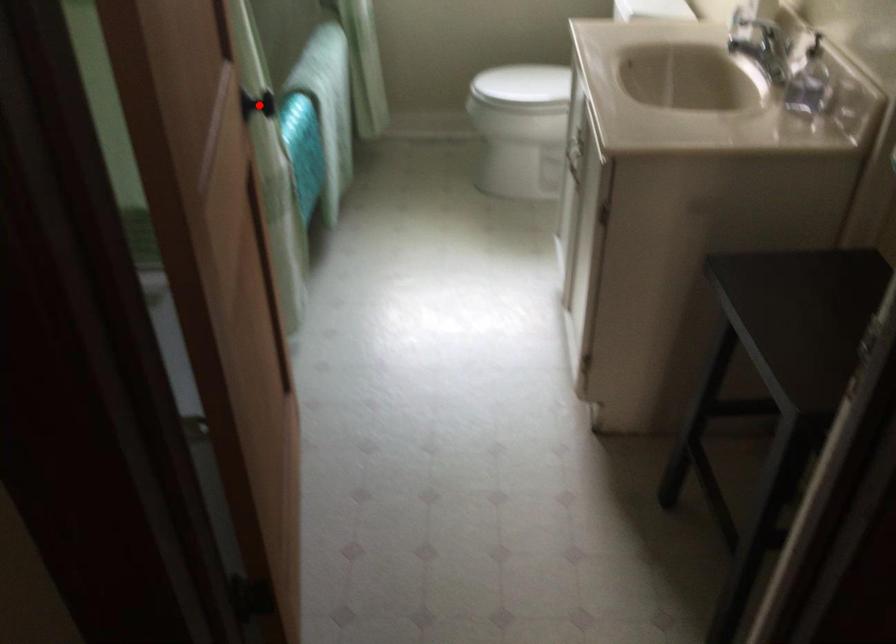
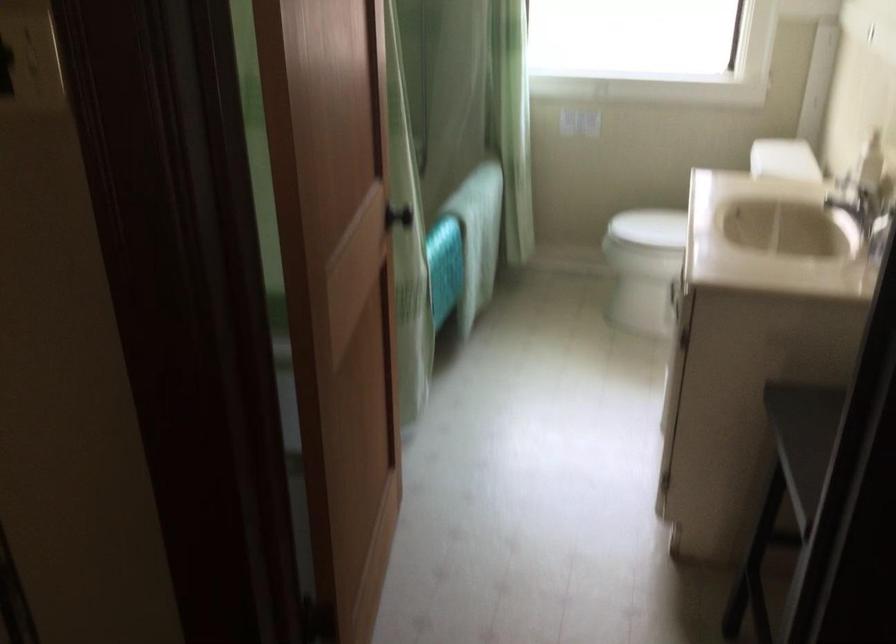
In the second image, find the point that corresponds to the highlighted location in the first image.

(397, 216)